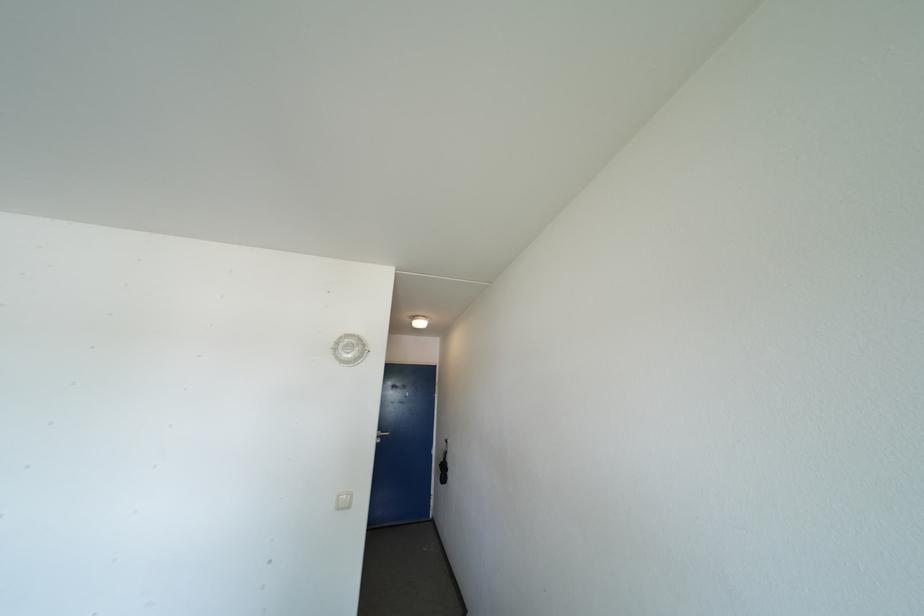
Where is `white light switch`? This screenshot has width=924, height=616. white light switch is located at coordinates (344, 500).